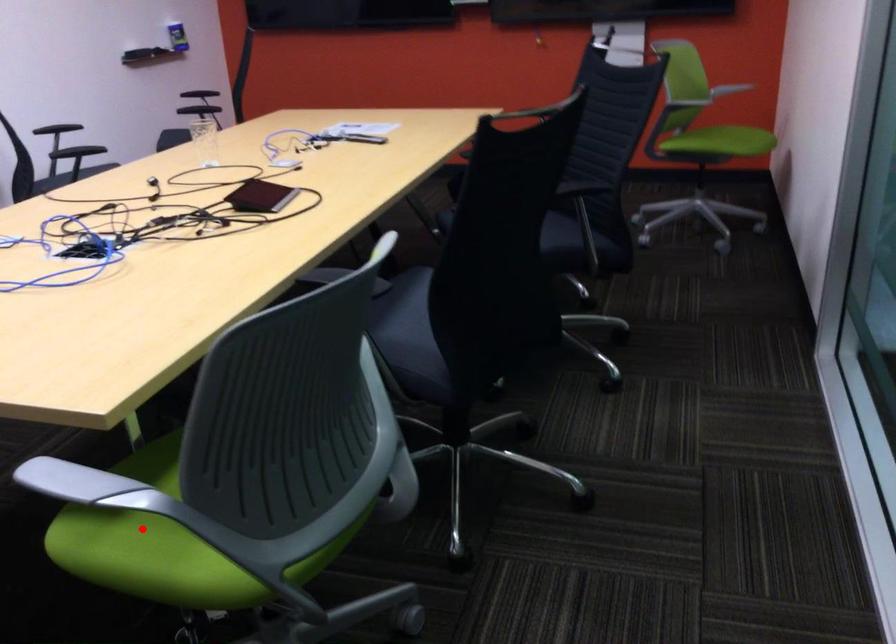
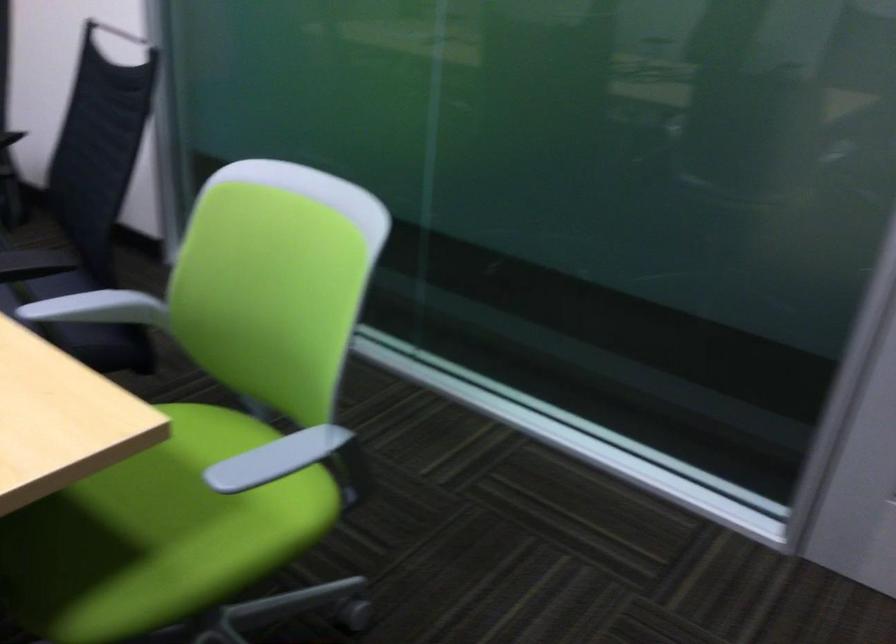
The point at the highlighted location is marked in the first image. Where is the corresponding point in the second image?

(157, 534)